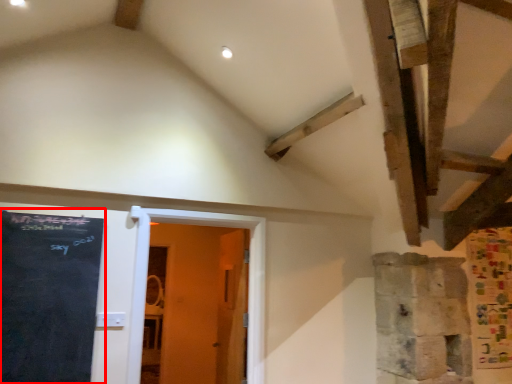
Question: In this image, where is bulletin board (annotated by the red box) located relative to door?

Choices:
 (A) left
 (B) right

Answer: (A)